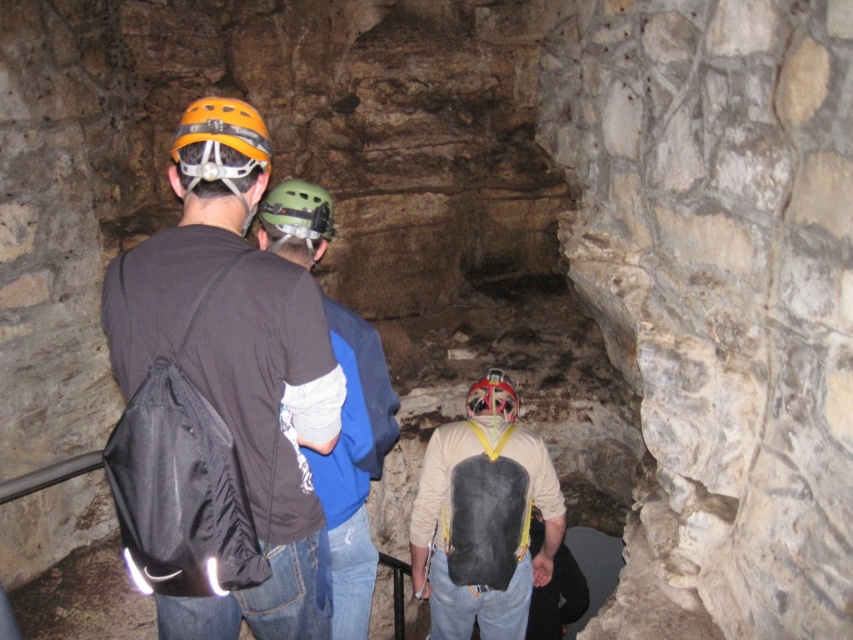
Find the location of a particular element. The image size is (853, 640). orange matte helmet at upper left is located at coordinates (222, 144).

Does matte green helmet at center have a smaller size compared to green matte helmet at center?

No, matte green helmet at center is not smaller than green matte helmet at center.

The image size is (853, 640). Find the location of `matte green helmet at center`. matte green helmet at center is located at coordinates (352, 467).

Which is behind, point (329, 502) or point (306, 236)?

The point (306, 236) is more distant.

The height and width of the screenshot is (640, 853). I want to click on matte green helmet at center, so click(352, 467).

Between matte green helmet at center and red matte helmet at center, which one appears on the left side from the viewer's perspective?

matte green helmet at center is more to the left.

In the scene shown: Does matte green helmet at center have a smaller size compared to red matte helmet at center?

Incorrect, matte green helmet at center is not smaller in size than red matte helmet at center.

This screenshot has height=640, width=853. Describe the element at coordinates (352, 467) in the screenshot. I see `matte green helmet at center` at that location.

Where is `matte green helmet at center`? Image resolution: width=853 pixels, height=640 pixels. matte green helmet at center is located at coordinates pyautogui.click(x=352, y=467).